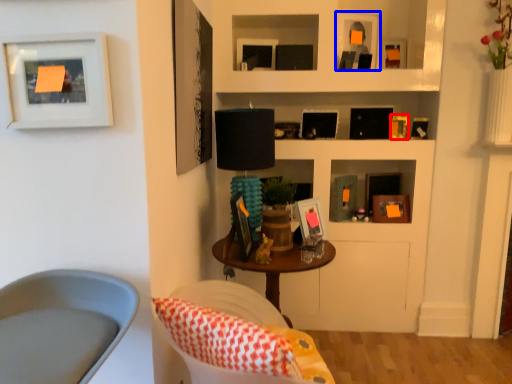
Question: Which point is closer to the camera, picture frame (highlighted by a red box) or picture frame (highlighted by a blue box)?

Choices:
 (A) picture frame
 (B) picture frame

Answer: (B)